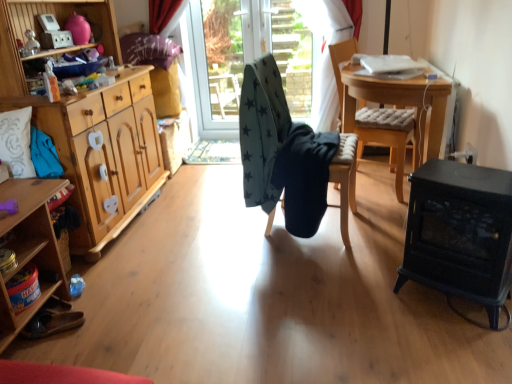
Question: Is wooden cabinet at left to the right of dark blue fabric at center, positioned as the 2th chair in right-to-left order, from the viewer's perspective?

Choices:
 (A) yes
 (B) no

Answer: (B)

Question: Is dark blue fabric at center, positioned as the 2th chair in right-to-left order, at the back of wooden cabinet at left?

Choices:
 (A) no
 (B) yes

Answer: (A)

Question: Considering the relative sizes of wooden cabinet at left and dark blue fabric at center, positioned as the 2th chair in right-to-left order, in the image provided, is wooden cabinet at left thinner than dark blue fabric at center, positioned as the 2th chair in right-to-left order,?

Choices:
 (A) no
 (B) yes

Answer: (A)

Question: From the image's perspective, is wooden cabinet at left on dark blue fabric at center, the second chair in the left-to-right sequence?

Choices:
 (A) yes
 (B) no

Answer: (B)

Question: Would you consider wooden cabinet at left to be distant from dark blue fabric at center, the second chair in the left-to-right sequence?

Choices:
 (A) no
 (B) yes

Answer: (B)

Question: Is wooden table at center bigger or smaller than black cast iron fireplace at lower right?

Choices:
 (A) small
 (B) big

Answer: (B)

Question: In the image, is wooden table at center positioned in front of or behind black cast iron fireplace at lower right?

Choices:
 (A) behind
 (B) front

Answer: (A)

Question: Does point (437, 135) appear closer or farther from the camera than point (468, 223)?

Choices:
 (A) farther
 (B) closer

Answer: (A)

Question: From the image's perspective, is wooden table at center above or below black cast iron fireplace at lower right?

Choices:
 (A) below
 (B) above

Answer: (B)

Question: From the image's perspective, is brown leather shoes at lower left located above or below dark gray fabric at center?

Choices:
 (A) above
 (B) below

Answer: (B)

Question: Does point (51, 312) appear closer or farther from the camera than point (259, 44)?

Choices:
 (A) farther
 (B) closer

Answer: (B)

Question: Is brown leather shoes at lower left wider or thinner than dark gray fabric at center?

Choices:
 (A) wide
 (B) thin

Answer: (A)

Question: Considering the positions of brown leather shoes at lower left and dark gray fabric at center in the image, is brown leather shoes at lower left taller or shorter than dark gray fabric at center?

Choices:
 (A) tall
 (B) short

Answer: (B)

Question: In terms of height, does brown leather shoes at lower left look taller or shorter compared to dark blue fabric at center, the second chair in the left-to-right sequence?

Choices:
 (A) tall
 (B) short

Answer: (B)

Question: Is brown leather shoes at lower left bigger or smaller than dark blue fabric at center, positioned as the 2th chair in right-to-left order?

Choices:
 (A) big
 (B) small

Answer: (B)